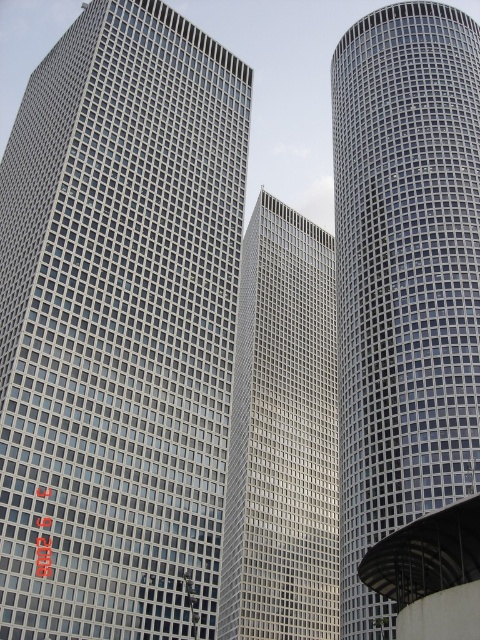
Can you confirm if metallic grid tower at center is positioned above matte glass skyscraper at center?

Indeed, metallic grid tower at center is positioned over matte glass skyscraper at center.

Who is positioned more to the left, metallic grid tower at center or matte glass skyscraper at center?

matte glass skyscraper at center

What do you see at coordinates (404, 280) in the screenshot? This screenshot has width=480, height=640. I see `metallic grid tower at center` at bounding box center [404, 280].

This screenshot has height=640, width=480. Find the location of `metallic grid tower at center`. metallic grid tower at center is located at coordinates click(404, 280).

Does matte glass building at left have a larger size compared to matte glass skyscraper at center?

Yes.

In order to click on matte glass building at left in this screenshot , I will do `click(119, 326)`.

The image size is (480, 640). What do you see at coordinates (119, 326) in the screenshot? I see `matte glass building at left` at bounding box center [119, 326].

I want to click on matte glass building at left, so click(x=119, y=326).

Where is `matte glass building at left`? This screenshot has width=480, height=640. matte glass building at left is located at coordinates (119, 326).

Who is shorter, matte glass building at left or metallic grid tower at center?

Standing shorter between the two is matte glass building at left.

Does point (204, 221) come farther from viewer compared to point (358, 212)?

No.

Locate an element on the screen. This screenshot has height=640, width=480. matte glass building at left is located at coordinates (119, 326).